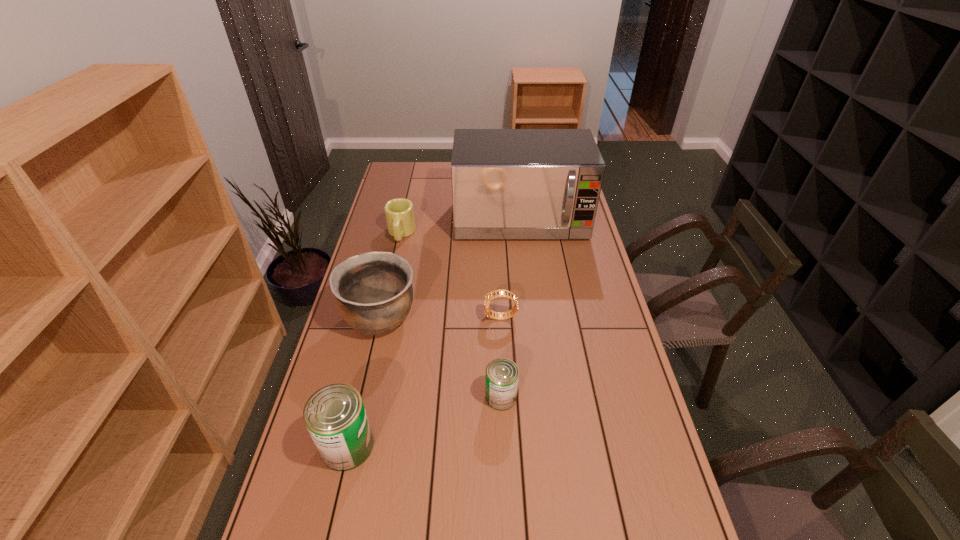
Identify the location of unoccupied position between the farther can and the pottery. (441, 357).

The width and height of the screenshot is (960, 540). Find the location of `free point between the pottery and the shorter can`. free point between the pottery and the shorter can is located at coordinates (441, 357).

Find the location of a particular element. free point between the shorter can and the pottery is located at coordinates 441,357.

You are a GUI agent. You are given a task and a screenshot of the screen. Output one action in this format:
    pyautogui.click(x=<x>, y=<y>)
    Task: Click on the empty location between the pottery and the taller can
    The width and height of the screenshot is (960, 540).
    Given the screenshot: What is the action you would take?
    pyautogui.click(x=364, y=382)

You are a GUI agent. You are given a task and a screenshot of the screen. Output one action in this format:
    pyautogui.click(x=<x>, y=<y>)
    Task: Click on the free space between the tallest object and the pottery
    This screenshot has width=960, height=540.
    Given the screenshot: What is the action you would take?
    pyautogui.click(x=450, y=269)

Image resolution: width=960 pixels, height=540 pixels. Identify the location of free spot between the watch and the nearer can. (424, 382).

Identify which object is located as the second nearest to the fifth farthest object. Please provide its 2D coordinates. Your answer should be formatted as a tuple, i.e. [(x, y)], where the tuple contains the x and y coordinates of a point satisfying the conditions above.

[(374, 293)]

Identify the location of the fourth closest object to the watch. The width and height of the screenshot is (960, 540). (335, 416).

Image resolution: width=960 pixels, height=540 pixels. I want to click on vacant region that satisfies the following two spatial constraints: 1. with the handle on the side of the mug; 2. on the right side of the right can, so click(365, 397).